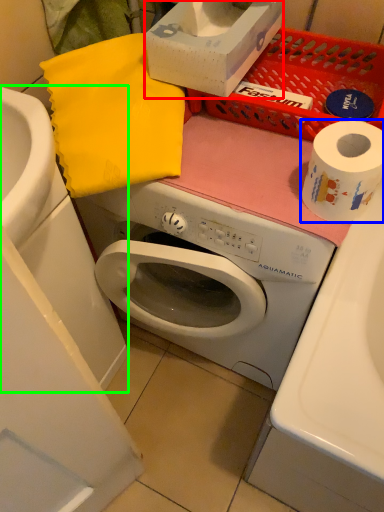
Question: Which object is positioned farthest from box (highlighted by a red box)? Select from toilet paper (highlighted by a blue box) and sink (highlighted by a green box).

Choices:
 (A) toilet paper
 (B) sink

Answer: (B)